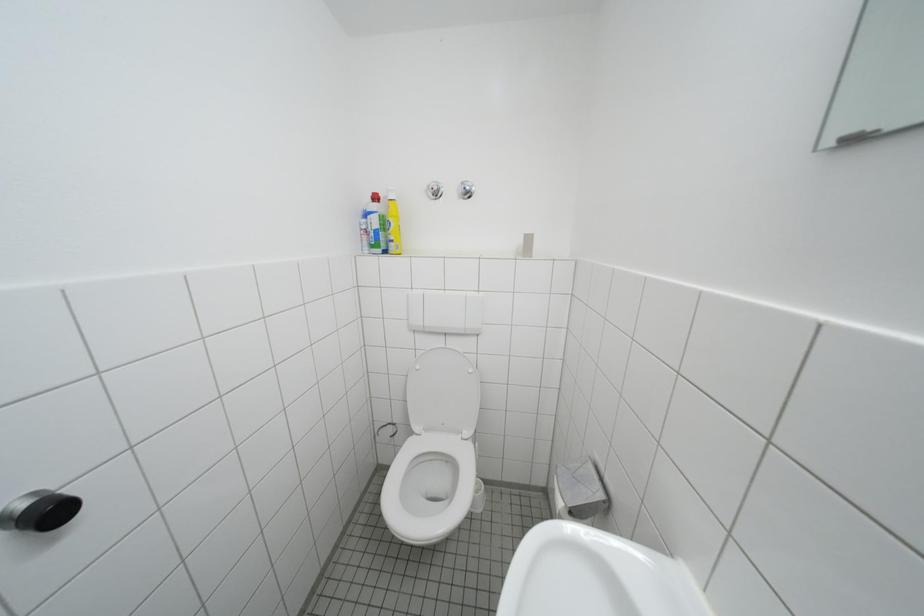
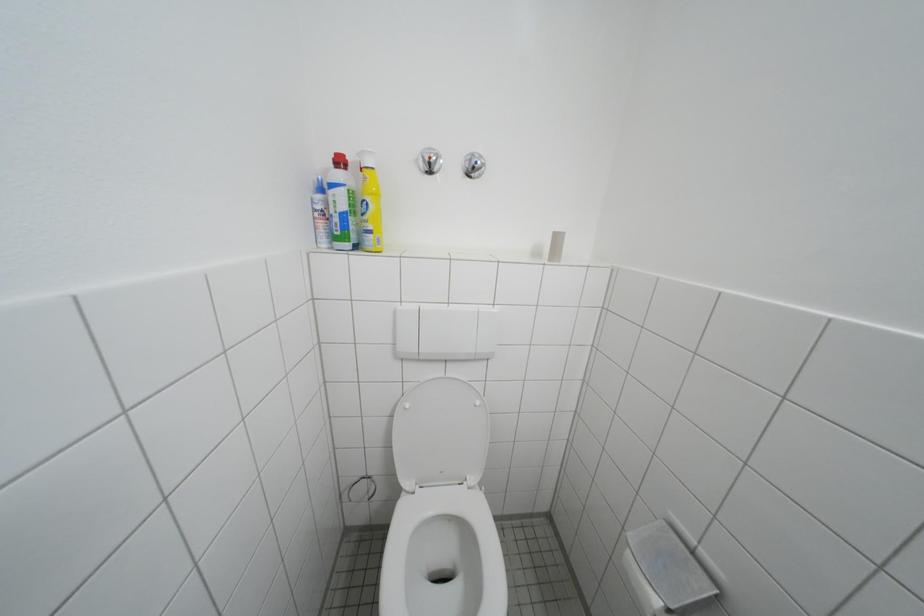
Question: The camera is either moving clockwise (left) or counter-clockwise (right) around the object. The first image is from the beginning of the video and the second image is from the end. Is the camera moving left or right when shooting the video?

Choices:
 (A) Left
 (B) Right

Answer: (A)